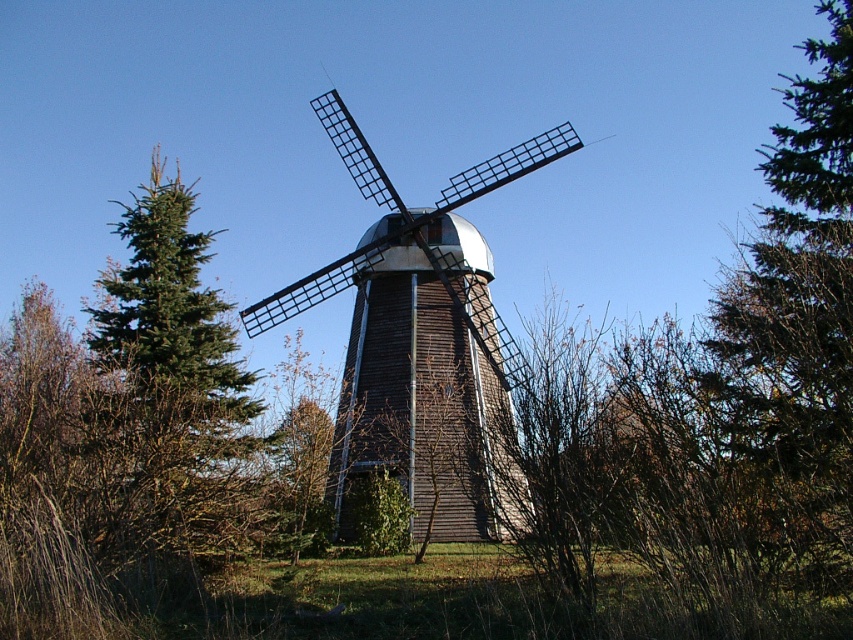
You are standing in the field and see the brown wooden windmill at center and the green grass at center. Which object takes up more space in the image?

The brown wooden windmill at center has a larger size compared to green grass at center, so it takes up more space in the image.

You are standing at the point labeled as point (422,344) in the image. Based on the scene description, which object are you currently touching?

The point (422,344) is on the brown wooden windmill at center, so you are touching the brown wooden windmill at center.